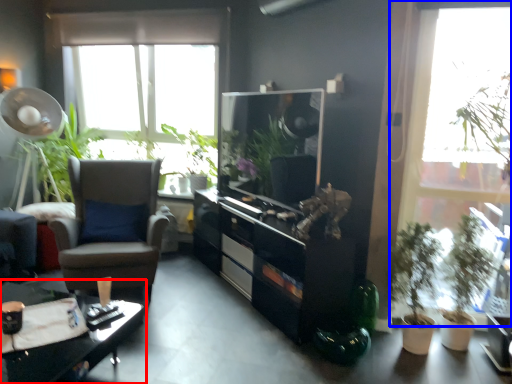
Question: Which point is closer to the camera, desk (highlighted by a red box) or window (highlighted by a blue box)?

Choices:
 (A) desk
 (B) window

Answer: (A)